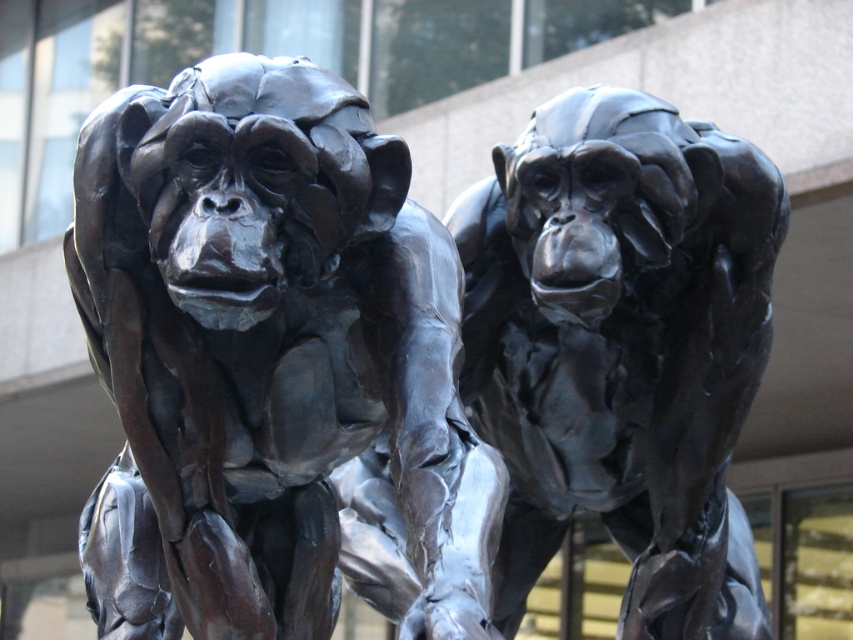
You are an art curator planning to display both the bronze statue at center and the polished bronze monkey at center in a gallery. Given their sizes, which one should be placed closer to the entrance to ensure visitors notice the larger piece first?

The bronze statue at center is larger than the polished bronze monkey at center, so placing it closer to the entrance will ensure visitors notice the larger piece first.